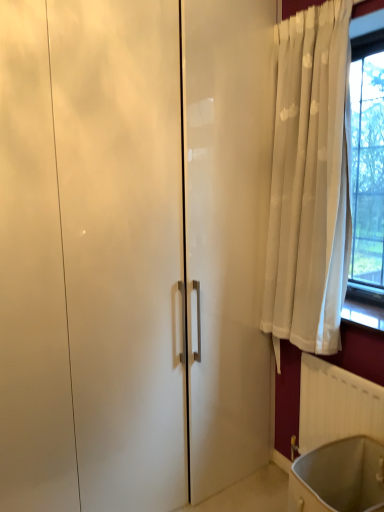
Question: Is white plastic radiator at lower right at the left side of matte white bath at lower right?

Choices:
 (A) no
 (B) yes

Answer: (A)

Question: From a real-world perspective, is white plastic radiator at lower right located beneath matte white bath at lower right?

Choices:
 (A) yes
 (B) no

Answer: (B)

Question: Can you confirm if white plastic radiator at lower right is bigger than matte white bath at lower right?

Choices:
 (A) yes
 (B) no

Answer: (B)

Question: Considering the relative sizes of white plastic radiator at lower right and matte white bath at lower right in the image provided, is white plastic radiator at lower right shorter than matte white bath at lower right?

Choices:
 (A) yes
 (B) no

Answer: (B)

Question: Is white plastic radiator at lower right facing away from matte white bath at lower right?

Choices:
 (A) no
 (B) yes

Answer: (A)

Question: Is white plastic radiator at lower right beside matte white bath at lower right?

Choices:
 (A) no
 (B) yes

Answer: (A)

Question: Are matte white bath at lower right and white plastic radiator at lower right located far from each other?

Choices:
 (A) no
 (B) yes

Answer: (A)

Question: Can you confirm if matte white bath at lower right is taller than white plastic radiator at lower right?

Choices:
 (A) no
 (B) yes

Answer: (A)

Question: Is matte white bath at lower right at the left side of white plastic radiator at lower right?

Choices:
 (A) yes
 (B) no

Answer: (A)

Question: Is matte white bath at lower right oriented away from white plastic radiator at lower right?

Choices:
 (A) yes
 (B) no

Answer: (B)

Question: Considering the relative sizes of matte white bath at lower right and white plastic radiator at lower right in the image provided, is matte white bath at lower right thinner than white plastic radiator at lower right?

Choices:
 (A) no
 (B) yes

Answer: (A)

Question: Can you confirm if matte white bath at lower right is smaller than white plastic radiator at lower right?

Choices:
 (A) no
 (B) yes

Answer: (A)

Question: Is point (382, 439) closer or farther from the camera than point (326, 451)?

Choices:
 (A) closer
 (B) farther

Answer: (A)